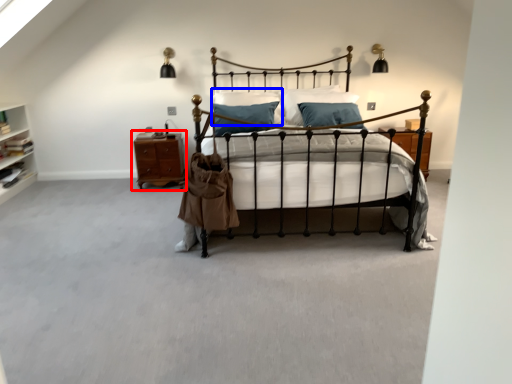
Question: Among these objects, which one is farthest to the camera, nightstand (highlighted by a red box) or pillow (highlighted by a blue box)?

Choices:
 (A) nightstand
 (B) pillow

Answer: (A)